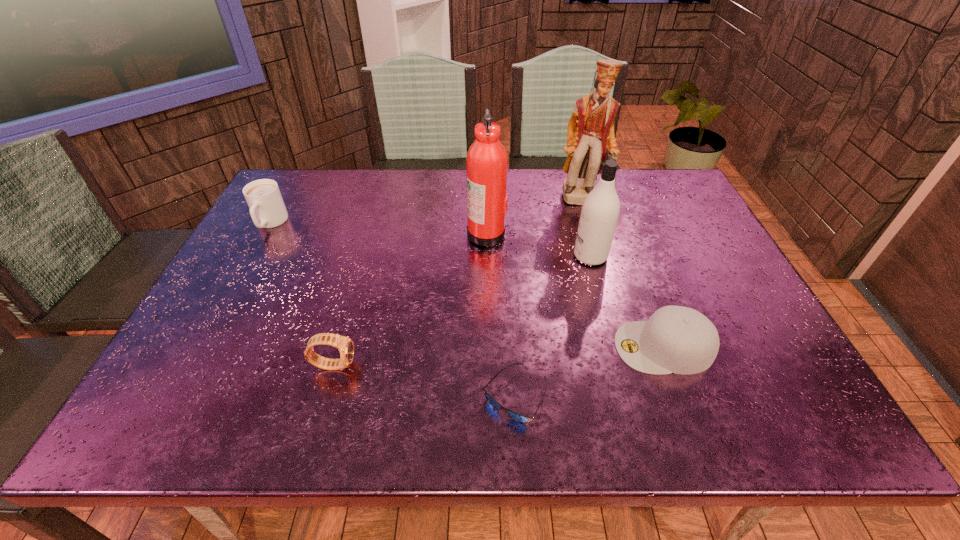
You are a GUI agent. You are given a task and a screenshot of the screen. Output one action in this format:
    pyautogui.click(x=<x>, y=<y>)
    Task: Click on the blank region between the shortest object and the fire extinguisher
    The height and width of the screenshot is (540, 960).
    Given the screenshot: What is the action you would take?
    pyautogui.click(x=500, y=315)

Locate an element on the screen. The height and width of the screenshot is (540, 960). free space between the nutcracker and the cap is located at coordinates (625, 273).

You are a GUI agent. You are given a task and a screenshot of the screen. Output one action in this format:
    pyautogui.click(x=<x>, y=<y>)
    Task: Click on the closest object to the sunglasses
    
    Given the screenshot: What is the action you would take?
    pyautogui.click(x=676, y=339)

Locate an element on the screen. the closest object to the third tallest object is located at coordinates (590, 133).